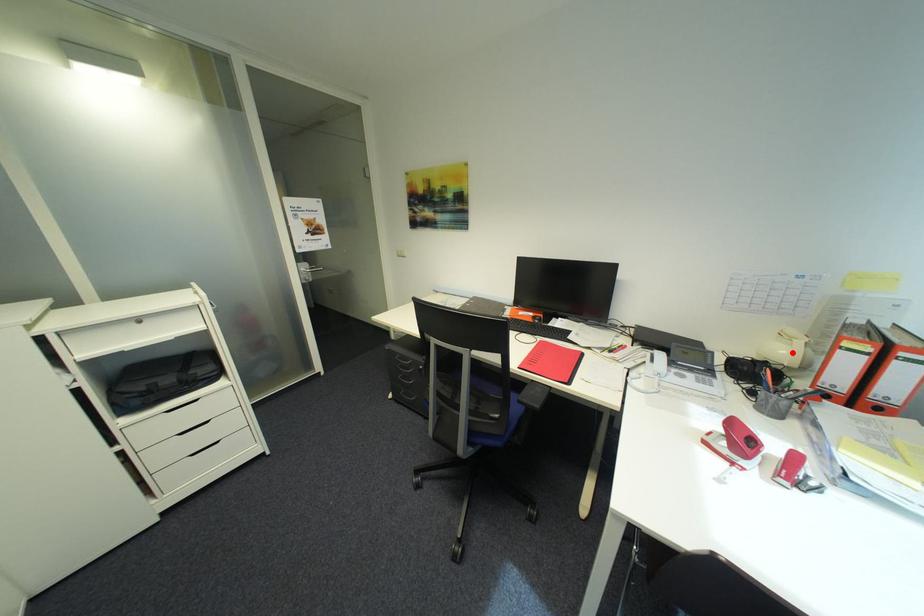
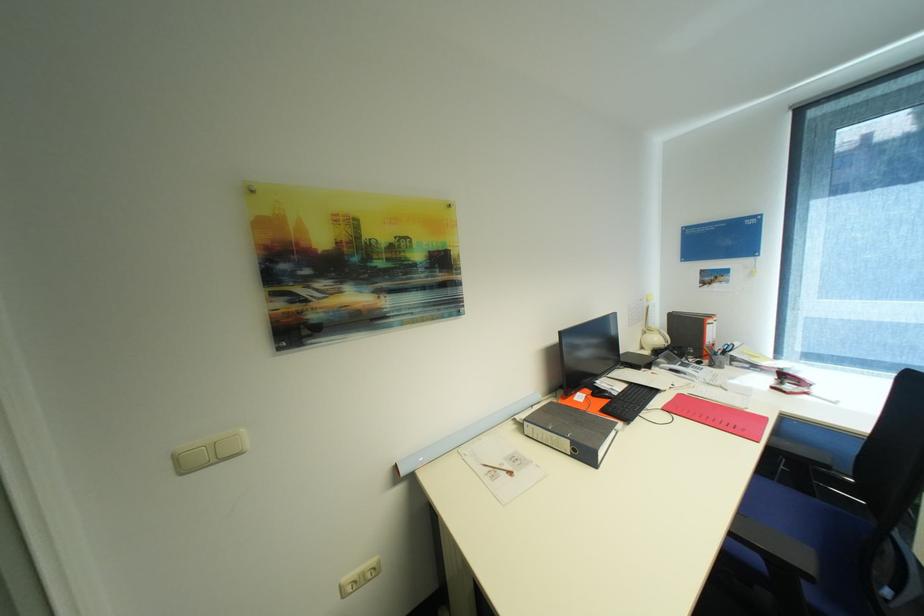
The point at the highlighted location is marked in the first image. Where is the corresponding point in the second image?

(663, 339)